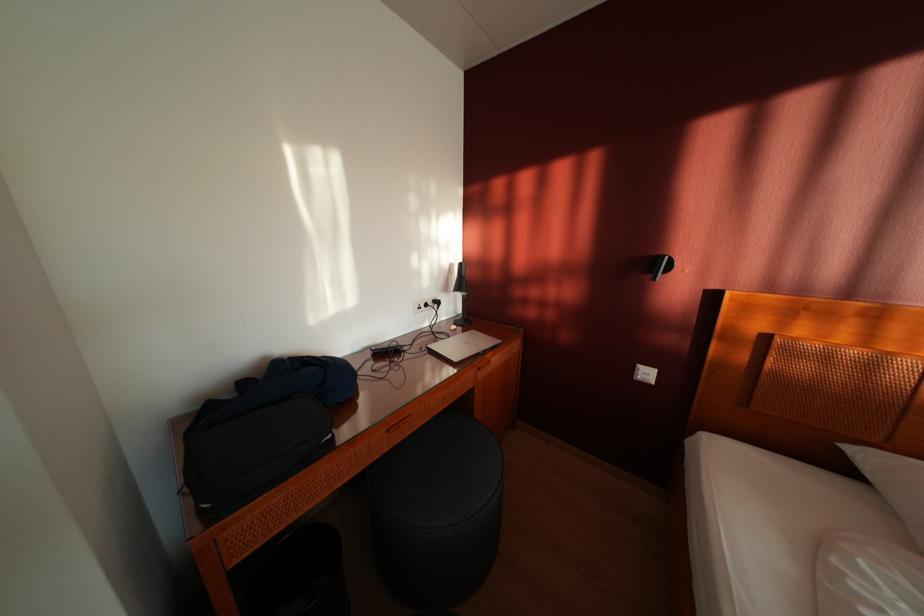
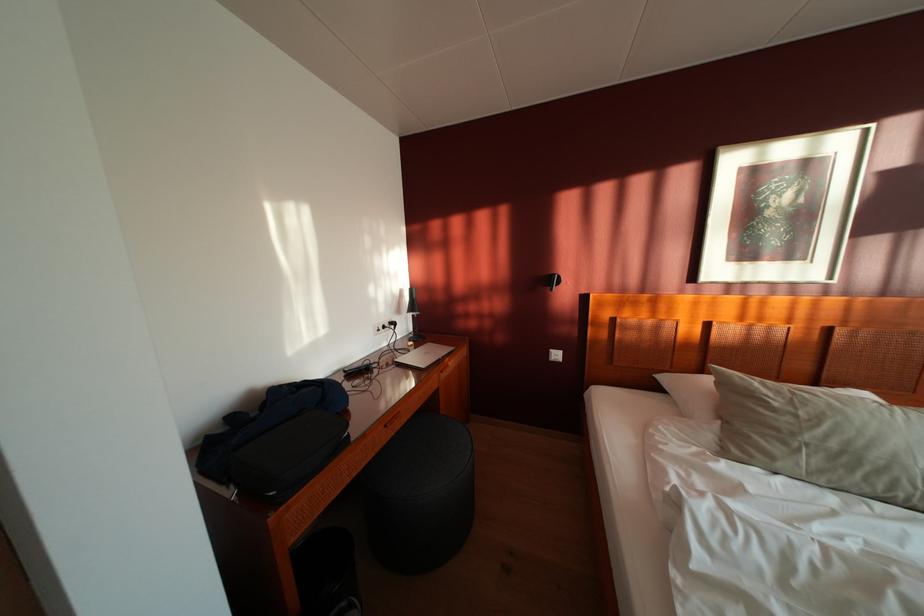
In the second image, find the point that corresponds to [463,333] in the first image.

(419, 349)